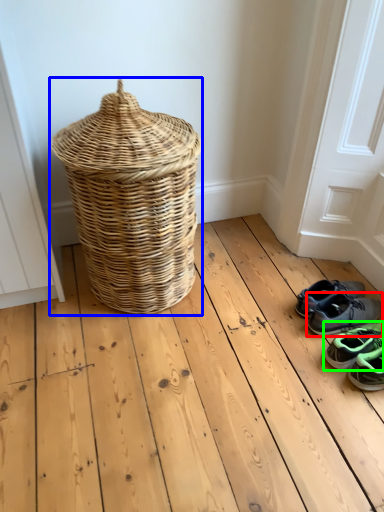
Question: Considering the real-world distances, which object is farthest from footwear (highlighted by a red box)? picnic basket (highlighted by a blue box) or footwear (highlighted by a green box)?

Choices:
 (A) picnic basket
 (B) footwear

Answer: (A)